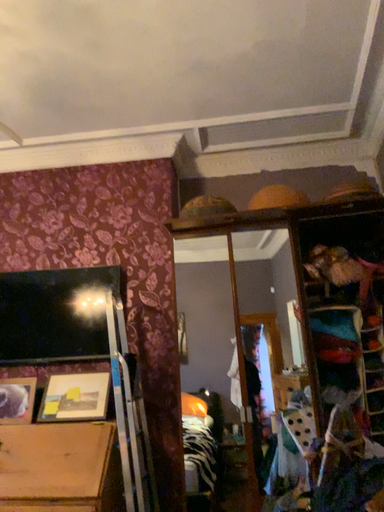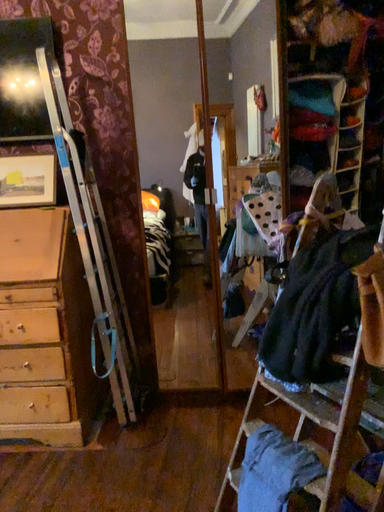
Question: How did the camera likely rotate when shooting the video?

Choices:
 (A) rotated left
 (B) rotated right

Answer: (B)